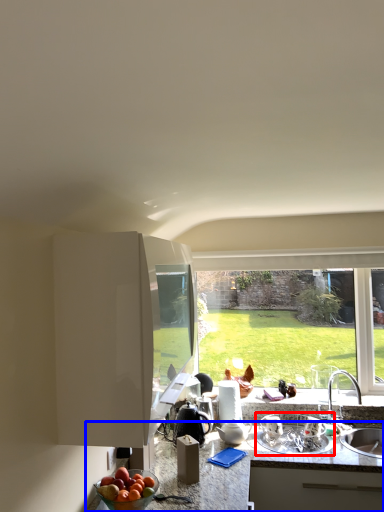
Question: Which object appears farthest to the camera in this image, appliance (highlighted by a red box) or countertop (highlighted by a blue box)?

Choices:
 (A) appliance
 (B) countertop

Answer: (A)